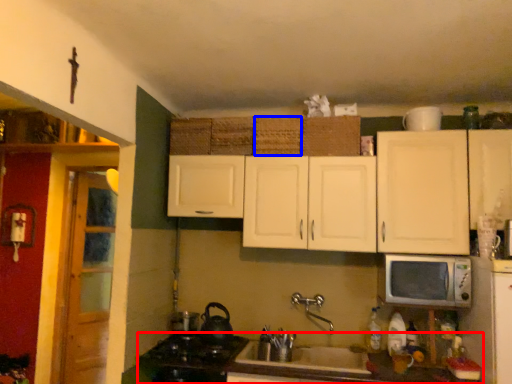
Question: Which object appears closest to the camera in this image, countertop (highlighted by a red box) or basket (highlighted by a blue box)?

Choices:
 (A) countertop
 (B) basket

Answer: (A)